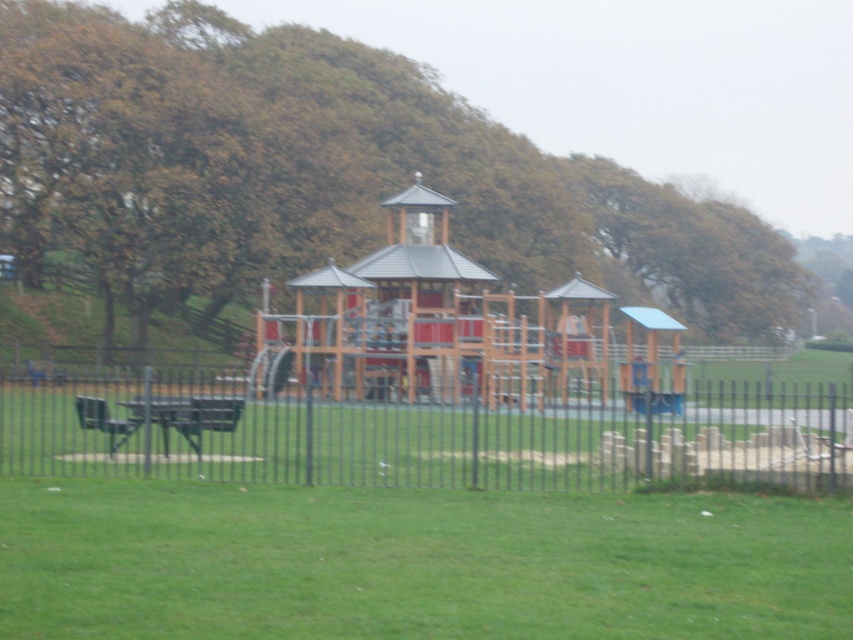
The image size is (853, 640). Describe the element at coordinates (317, 179) in the screenshot. I see `brown wood tree at center` at that location.

Between brown wood tree at center and black metal fence at center, which one is positioned higher?

brown wood tree at center

Identify the location of brown wood tree at center. Image resolution: width=853 pixels, height=640 pixels. (317, 179).

Measure the distance between point (335, 140) and camera.

They are 60.29 meters apart.

This screenshot has height=640, width=853. Describe the element at coordinates (317, 179) in the screenshot. I see `brown wood tree at center` at that location.

Describe the element at coordinates (317, 179) in the screenshot. This screenshot has height=640, width=853. I see `brown wood tree at center` at that location.

Image resolution: width=853 pixels, height=640 pixels. In order to click on brown wood tree at center in this screenshot , I will do `click(317, 179)`.

Can you confirm if black metal fence at center is positioned to the left of wooden gazebo at center?

Correct, you'll find black metal fence at center to the left of wooden gazebo at center.

The width and height of the screenshot is (853, 640). What are the coordinates of `black metal fence at center` in the screenshot? It's located at (416, 433).

Who is more forward, (311,410) or (376,252)?

Point (311,410) is in front.

Where is `black metal fence at center`? Image resolution: width=853 pixels, height=640 pixels. black metal fence at center is located at coordinates [x=416, y=433].